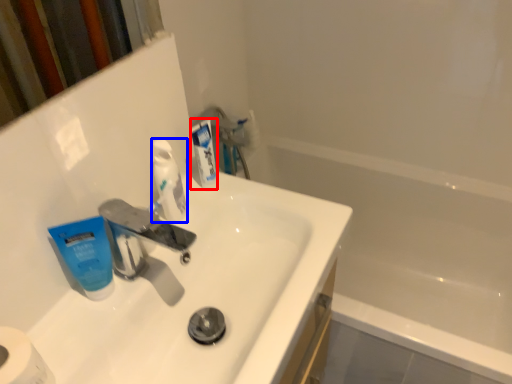
Question: Which object is closer to the camera taking this photo, toothpaste (highlighted by a red box) or toothpaste (highlighted by a blue box)?

Choices:
 (A) toothpaste
 (B) toothpaste

Answer: (B)